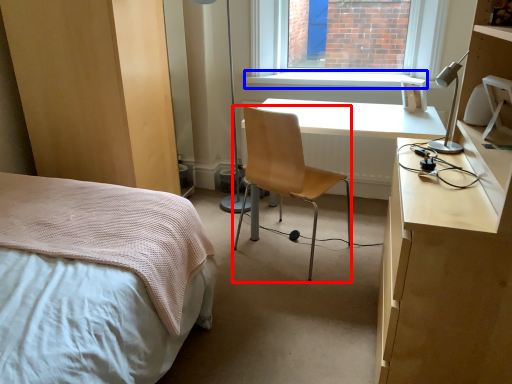
Question: Among these objects, which one is farthest to the camera, chair (highlighted by a red box) or window sill (highlighted by a blue box)?

Choices:
 (A) chair
 (B) window sill

Answer: (B)